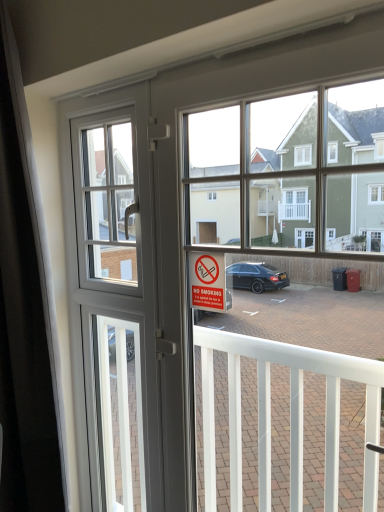
Question: Does black matte curtain at left appear on the right side of white plastic window screen at upper left?

Choices:
 (A) no
 (B) yes

Answer: (A)

Question: From the image's perspective, does black matte curtain at left appear lower than white plastic window screen at upper left?

Choices:
 (A) yes
 (B) no

Answer: (A)

Question: Is black matte curtain at left outside of white plastic window screen at upper left?

Choices:
 (A) no
 (B) yes

Answer: (B)

Question: From a real-world perspective, is black matte curtain at left on white plastic window screen at upper left?

Choices:
 (A) yes
 (B) no

Answer: (B)

Question: Is black matte curtain at left facing away from white plastic window screen at upper left?

Choices:
 (A) yes
 (B) no

Answer: (A)

Question: In the image, is no smoking" sign at center on the left side or the right side of black matte curtain at left?

Choices:
 (A) left
 (B) right

Answer: (B)

Question: Is no smoking" sign at center taller or shorter than black matte curtain at left?

Choices:
 (A) short
 (B) tall

Answer: (A)

Question: Considering the positions of no smoking" sign at center and black matte curtain at left in the image, is no smoking" sign at center wider or thinner than black matte curtain at left?

Choices:
 (A) thin
 (B) wide

Answer: (A)

Question: Choose the correct answer: Is no smoking" sign at center inside black matte curtain at left or outside it?

Choices:
 (A) inside
 (B) outside

Answer: (B)

Question: Considering the positions of point (21, 335) and point (213, 258), is point (21, 335) closer or farther from the camera than point (213, 258)?

Choices:
 (A) closer
 (B) farther

Answer: (B)

Question: From the image's perspective, relative to no smoking" sign at center, is black matte curtain at left above or below?

Choices:
 (A) above
 (B) below

Answer: (B)

Question: Visually, is black matte curtain at left positioned to the left or to the right of no smoking" sign at center?

Choices:
 (A) right
 (B) left

Answer: (B)

Question: Looking at their shapes, would you say black matte curtain at left is wider or thinner than no smoking" sign at center?

Choices:
 (A) wide
 (B) thin

Answer: (A)

Question: Looking at the image, does black matte curtain at left seem bigger or smaller compared to clear glass screen door at center?

Choices:
 (A) small
 (B) big

Answer: (B)

Question: From a real-world perspective, is black matte curtain at left physically located above or below clear glass screen door at center?

Choices:
 (A) above
 (B) below

Answer: (A)